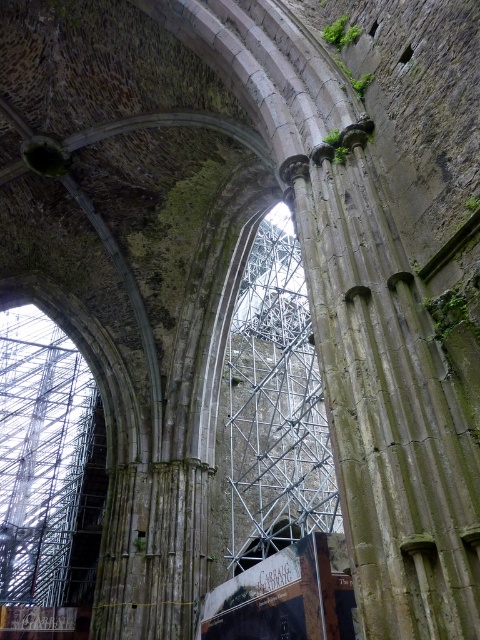
Describe the element at coordinates (386, 404) in the screenshot. Image resolution: width=480 pixels, height=640 pixels. I see `green mossy stone pillar at center` at that location.

Is green mossy stone pillar at center shorter than metallic scaffolding at center?

Yes, green mossy stone pillar at center is shorter than metallic scaffolding at center.

The width and height of the screenshot is (480, 640). Find the location of `green mossy stone pillar at center`. green mossy stone pillar at center is located at coordinates (386, 404).